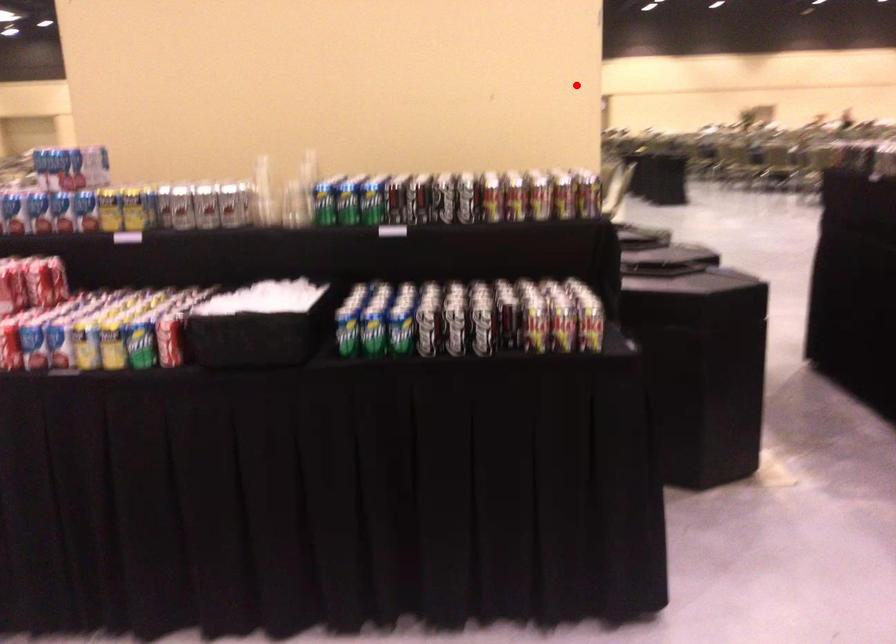
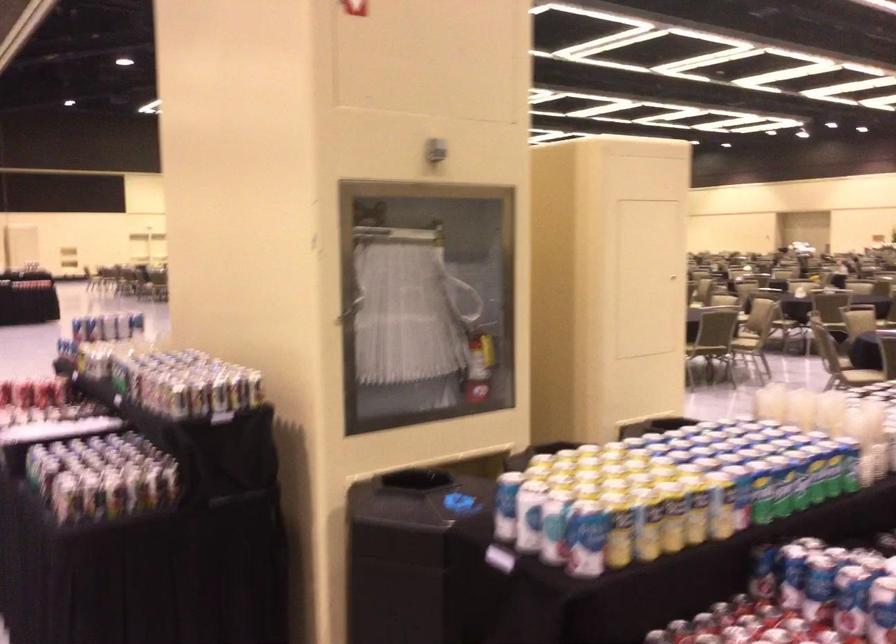
Find the pixel in the second image that matches the highlighted location in the first image.

(349, 310)